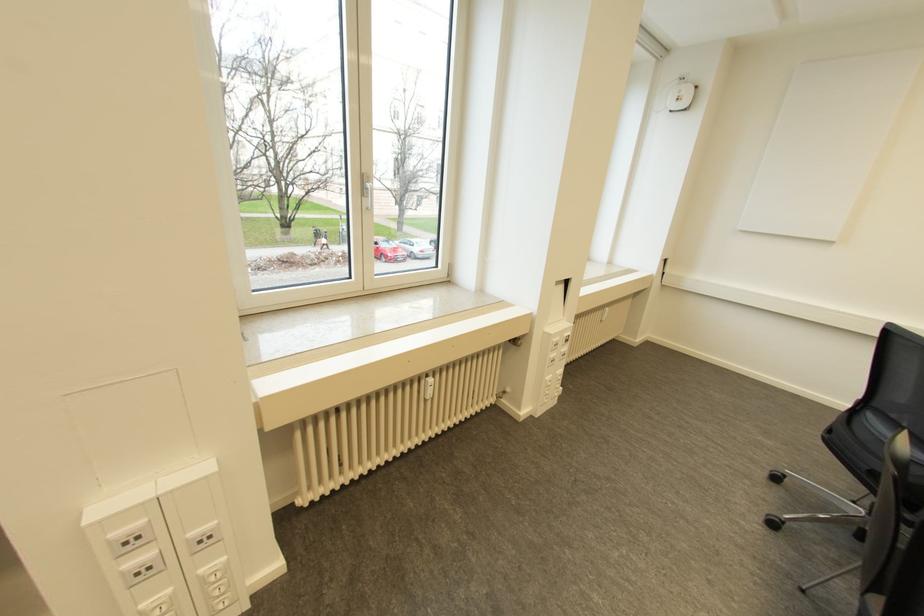
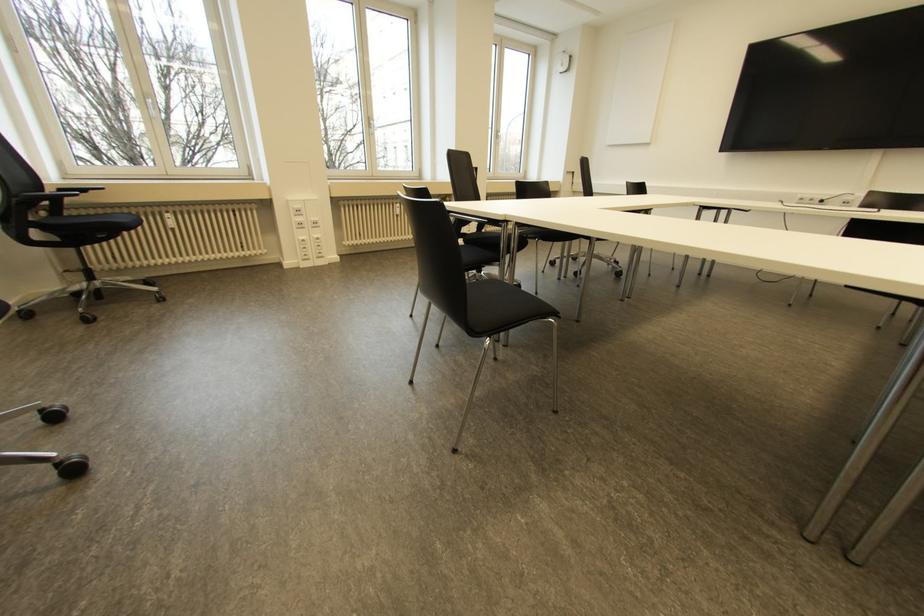
The point at (369,209) is marked in the first image. Where is the corresponding point in the second image?

(372, 134)